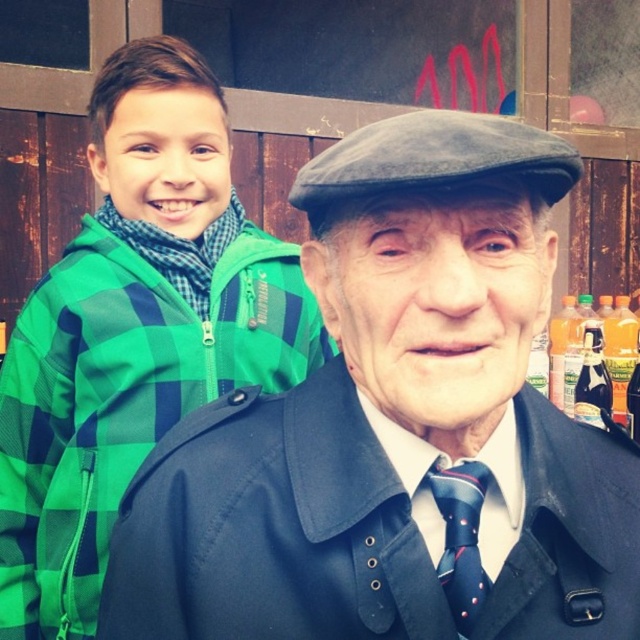
Who is more distant from viewer, (273,355) or (449,541)?

Positioned behind is point (273,355).

Between green checkered jacket at left and dark blue silk tie at center, which one is positioned higher?

green checkered jacket at left is higher up.

Between point (118, 115) and point (452, 532), which one is positioned in front?

Point (452, 532)

At what (x,y) coordinates should I click in order to perform the action: click on green checkered jacket at left. Please return your answer as a coordinate pair (x, y). This screenshot has width=640, height=640. Looking at the image, I should click on (134, 330).

Is matte black coat at center bigger than dark blue silk tie at center?

Yes.

Can you confirm if matte black coat at center is positioned below dark blue silk tie at center?

No, matte black coat at center is not below dark blue silk tie at center.

Which is behind, point (385, 564) or point (472, 598)?

Point (472, 598)

Where is `matte black coat at center`? The image size is (640, 640). matte black coat at center is located at coordinates (394, 422).

Who is lower down, matte black coat at center or green checkered jacket at left?

matte black coat at center is lower down.

Who is positioned more to the left, matte black coat at center or green checkered jacket at left?

green checkered jacket at left is more to the left.

Is point (182, 422) closer to viewer compared to point (177, 365)?

Yes.

The image size is (640, 640). Identify the location of matte black coat at center. (394, 422).